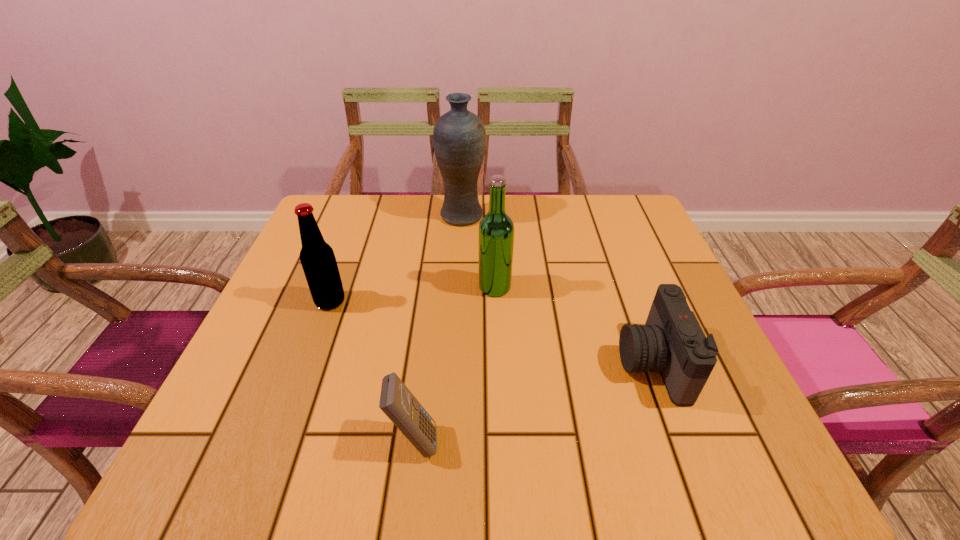
I want to click on free point located 0.250m on the front-facing side of the calculator, so click(591, 439).

You are a GUI agent. You are given a task and a screenshot of the screen. Output one action in this format:
    pyautogui.click(x=<x>, y=<y>)
    Task: Click on the vacant space located at the lens of the rightmost object
    
    Given the screenshot: What is the action you would take?
    pyautogui.click(x=443, y=363)

Find the location of `vacant region located 0.260m at the lens of the rightmost object`. vacant region located 0.260m at the lens of the rightmost object is located at coordinates (485, 363).

What are the coordinates of `vacant space positioned at the lens of the rightmost object` in the screenshot? It's located at (x=506, y=363).

The image size is (960, 540). In order to click on object present at the far edge in this screenshot , I will do `click(459, 138)`.

Locate an element on the screen. The height and width of the screenshot is (540, 960). object that is at the near edge is located at coordinates (398, 403).

Locate an element on the screen. This screenshot has width=960, height=540. object that is at the left edge is located at coordinates (x=317, y=258).

This screenshot has height=540, width=960. What are the coordinates of `object that is at the right edge` in the screenshot? It's located at (672, 342).

The height and width of the screenshot is (540, 960). I want to click on free space at the far edge of the desktop, so click(x=531, y=204).

I want to click on vacant space at the near edge of the desktop, so click(356, 440).